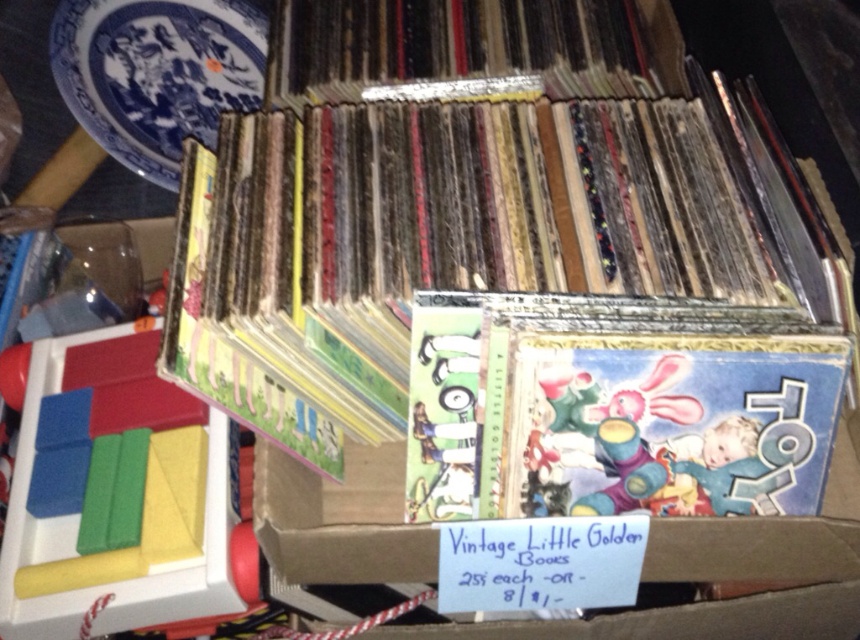
You are setting up a flea market stall and have a blue porcelain plate at upper left and rubberized plastic blocks at left. You need to place them side by side on a shelf. Which item should you place first to ensure they fit without overlapping?

The blue porcelain plate at upper left should be placed first because the rubberized plastic blocks at left are wider, so starting with the narrower item allows space for both to fit side by side.

You are at a flea market and see the cardboard box with vintage books and other items. You need to place a new item between the rubberized plastic blocks at left and the blue porcelain plate at upper left. Where should you position it to be between them?

To place the new item between the rubberized plastic blocks at left and the blue porcelain plate at upper left, position it above the rubberized plastic blocks at left but below the blue porcelain plate at upper left since the blocks are located below the plate.